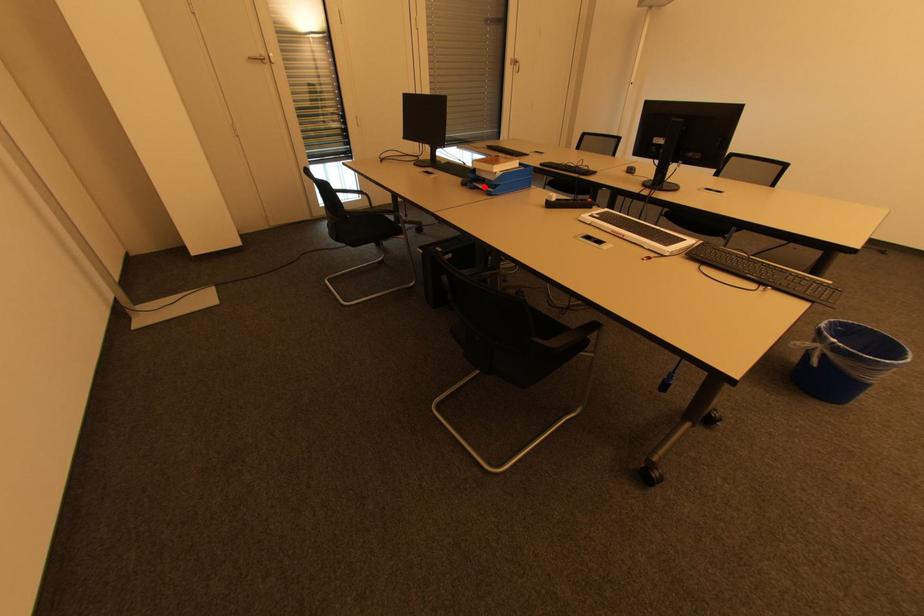
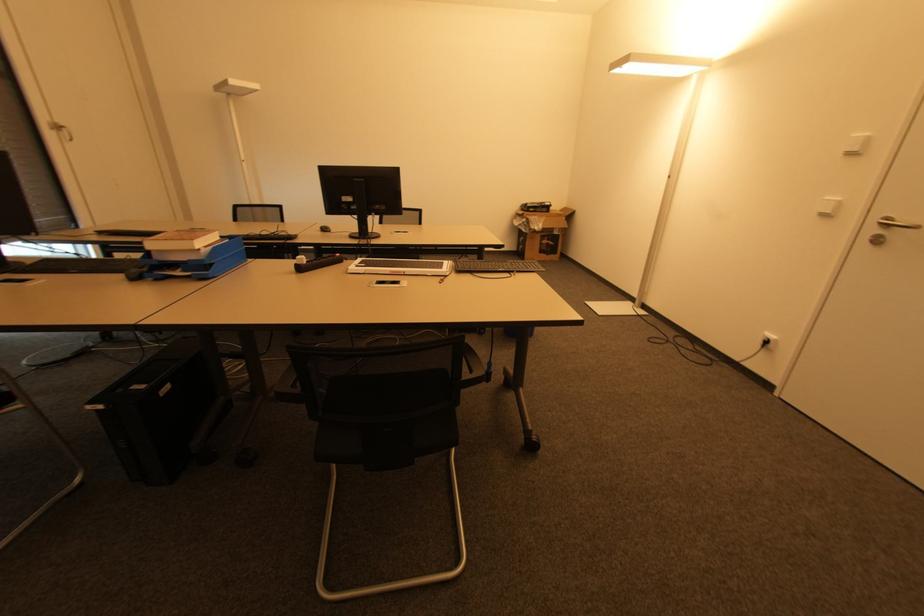
The point at the highlighted location is marked in the first image. Where is the corresponding point in the second image?

(178, 274)